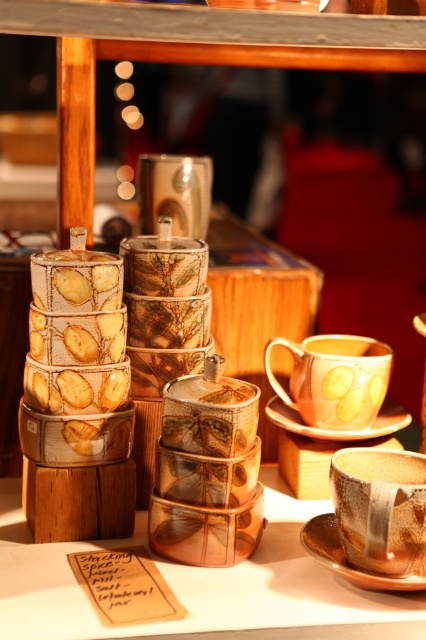
Can you confirm if translucent amber glass jars at center is thinner than matte gold cup at lower right?

No.

Who is more forward, (271, 586) or (388, 572)?

Positioned in front is point (388, 572).

Which is behind, point (49, 611) or point (417, 472)?

The point (417, 472) is more distant.

Image resolution: width=426 pixels, height=640 pixels. Find the location of `translucent amber glass jars at center`. translucent amber glass jars at center is located at coordinates (201, 584).

Between matte gold cup at lower right and yellow glazed cup at center, which one is positioned higher?

yellow glazed cup at center is higher up.

Does matte gold cup at lower right have a greater height compared to yellow glazed cup at center?

No, matte gold cup at lower right is not taller than yellow glazed cup at center.

Is point (348, 545) positioned behind point (333, 394)?

No.

Locate an element on the screen. matte gold cup at lower right is located at coordinates (379, 508).

Does matte gold cup at lower right appear over brown ceramic saucer at lower right?

Yes.

Between matte gold cup at lower right and brown ceramic saucer at lower right, which one appears on the left side from the viewer's perspective?

brown ceramic saucer at lower right is more to the left.

Who is more forward, (339, 492) or (367, 588)?

Point (367, 588)

The height and width of the screenshot is (640, 426). In order to click on matte gold cup at lower right in this screenshot , I will do `click(379, 508)`.